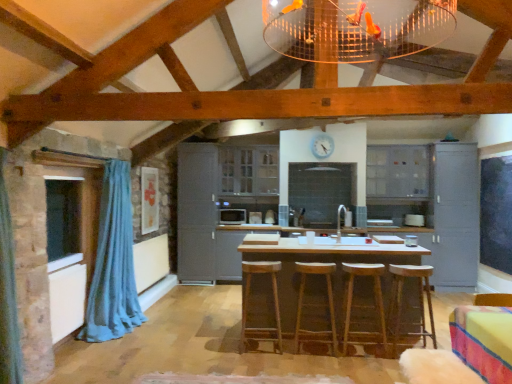
This screenshot has height=384, width=512. I want to click on free space to the left of brown wooden bar stool at center, placed as the 1th bar stool when sorted from left to right, so click(x=220, y=348).